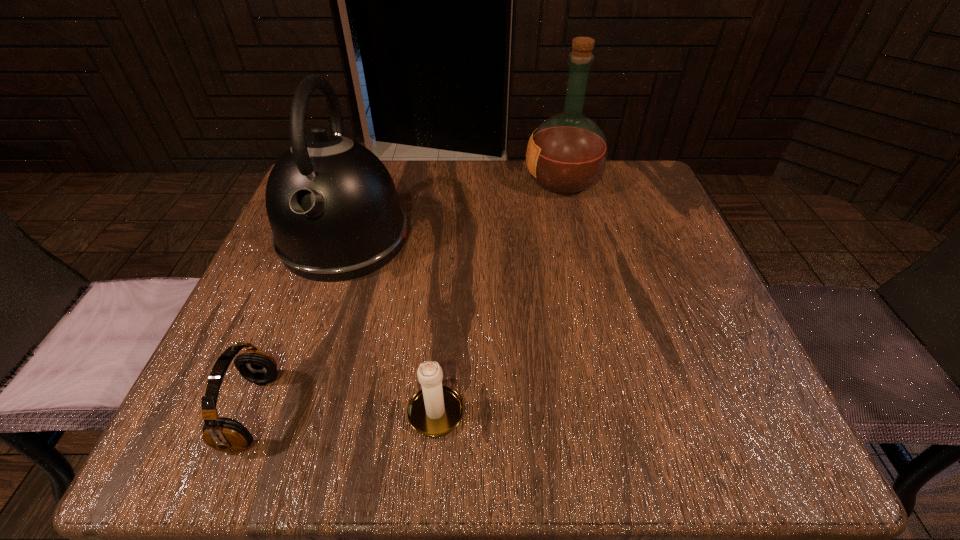
Identify the location of free location located on the handle side of the second object from right to left. (450, 222).

The image size is (960, 540). Find the location of `free region located on the ear cups of the headset`. free region located on the ear cups of the headset is located at coordinates (444, 411).

This screenshot has width=960, height=540. I want to click on liquor that is at the far edge, so click(x=567, y=153).

You are a GUI agent. You are given a task and a screenshot of the screen. Output one action in this format:
    pyautogui.click(x=<x>, y=<y>)
    Task: Click on the kettle at the far edge
    The width and height of the screenshot is (960, 540).
    Given the screenshot: What is the action you would take?
    pyautogui.click(x=332, y=205)

Locate an element on the screen. This screenshot has height=540, width=960. candle holder that is positioned at the near edge is located at coordinates (434, 411).

Where is `headset positioned at the near edge`? Image resolution: width=960 pixels, height=540 pixels. headset positioned at the near edge is located at coordinates (223, 434).

Locate an element on the screen. kettle located at the left edge is located at coordinates (332, 205).

Where is `headset located in the left edge section of the desktop`? This screenshot has width=960, height=540. headset located in the left edge section of the desktop is located at coordinates (223, 434).

You are a GUI agent. You are given a task and a screenshot of the screen. Output one action in this format:
    pyautogui.click(x=<x>, y=<y>)
    Task: Click on the object that is positioned at the right edge
    
    Given the screenshot: What is the action you would take?
    pyautogui.click(x=567, y=153)

I want to click on object at the far left corner, so click(332, 205).